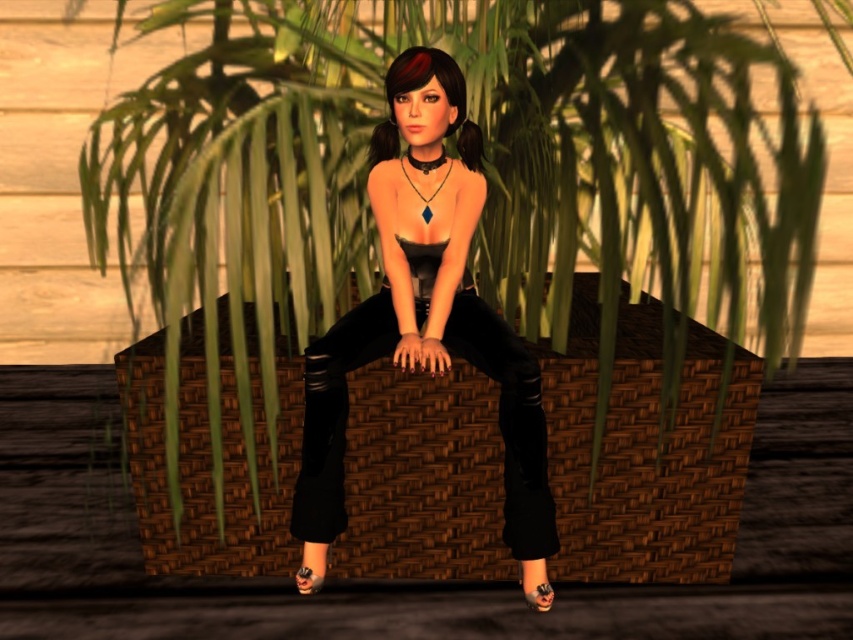
Where is the matte black pants at center located in the image?

The matte black pants at center is located at point (422, 314) in the image.

You are a fashion designer observing the image. You need to determine which item of clothing is larger in size between the matte black pants at center and the black leather sandal at lower center. Which one is bigger?

The matte black pants at center is bigger than the black leather sandal at lower center according to the description.

You are a photographer setting up a shoot and need to position a prop between the matte black pants at center and the black leather sandal at lower center. Based on their positions, which object should the prop be placed closer to?

The prop should be placed closer to the black leather sandal at lower center because the matte black pants at center is to the left of it, meaning the sandal is positioned further to the right. Placing the prop near the sandal would maintain symmetry between the two objects.